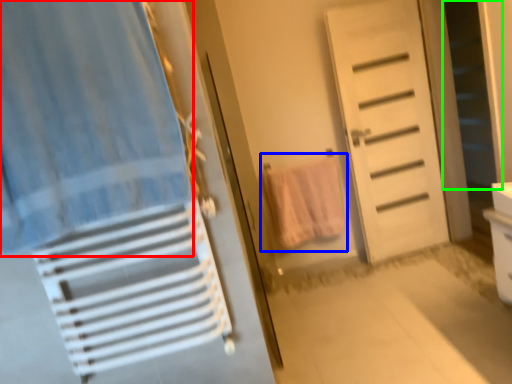
Question: Which object is positioned closest to curtain (highlighted by a red box)? Select from beach towel (highlighted by a blue box) and screen door (highlighted by a green box).

Choices:
 (A) beach towel
 (B) screen door

Answer: (A)